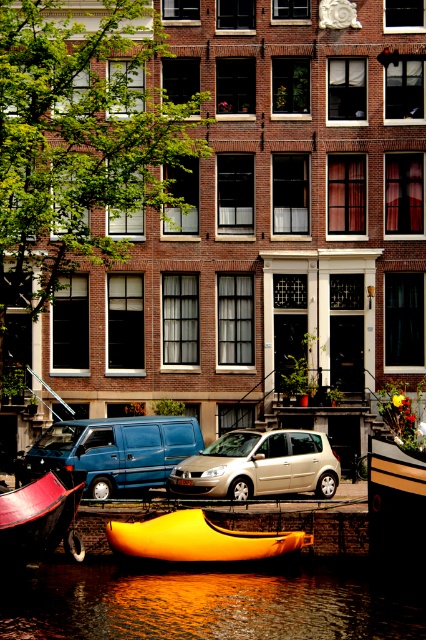
You are standing on the canal side and want to board the matte red boat at lower left. Which direction should you walk from the reflective water at lower center to reach it?

Since the reflective water at lower center is positioned on the right side of the matte red boat at lower left, you should walk to the left from the reflective water at lower center to reach the matte red boat at lower left.

You are a delivery person needing to park your vehicle, which is 2 meters wide, in this scene. You see the blue matte van at center and the matte red boat at lower left. Which one can you park your vehicle next to without overlapping?

The blue matte van at center has a width less than the matte red boat at lower left, so the matte red boat at lower left is wider. Since your vehicle is 2 meters wide, you can park next to the matte red boat at lower left as it has enough space.